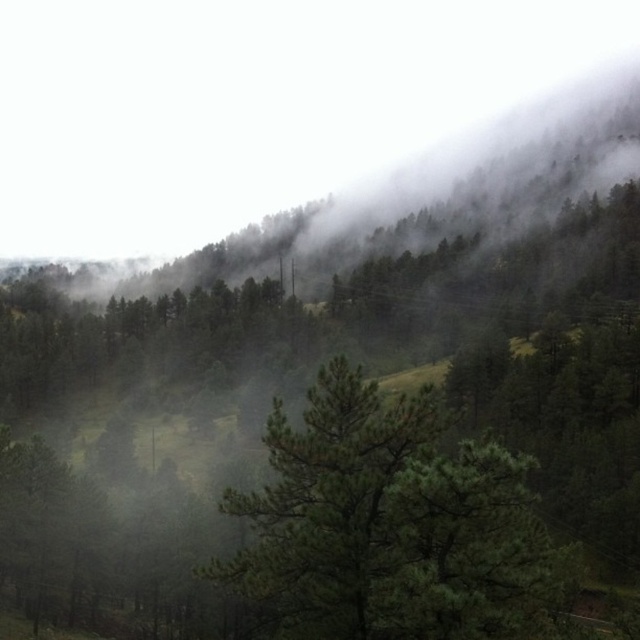
Question: Is foggy mist at upper center further to the viewer compared to green matte tree at center?

Choices:
 (A) yes
 (B) no

Answer: (A)

Question: Does foggy mist at upper center have a greater width compared to green matte tree at center?

Choices:
 (A) yes
 (B) no

Answer: (A)

Question: Among these points, which one is farthest from the camera?

Choices:
 (A) (500, 520)
 (B) (476, 52)

Answer: (B)

Question: Can you confirm if foggy mist at upper center is positioned below green matte tree at center?

Choices:
 (A) no
 (B) yes

Answer: (A)

Question: Which point is closer to the camera taking this photo?

Choices:
 (A) (333, 403)
 (B) (193, 140)

Answer: (A)

Question: Which object is closer to the camera taking this photo?

Choices:
 (A) foggy mist at upper center
 (B) green matte tree at center

Answer: (B)